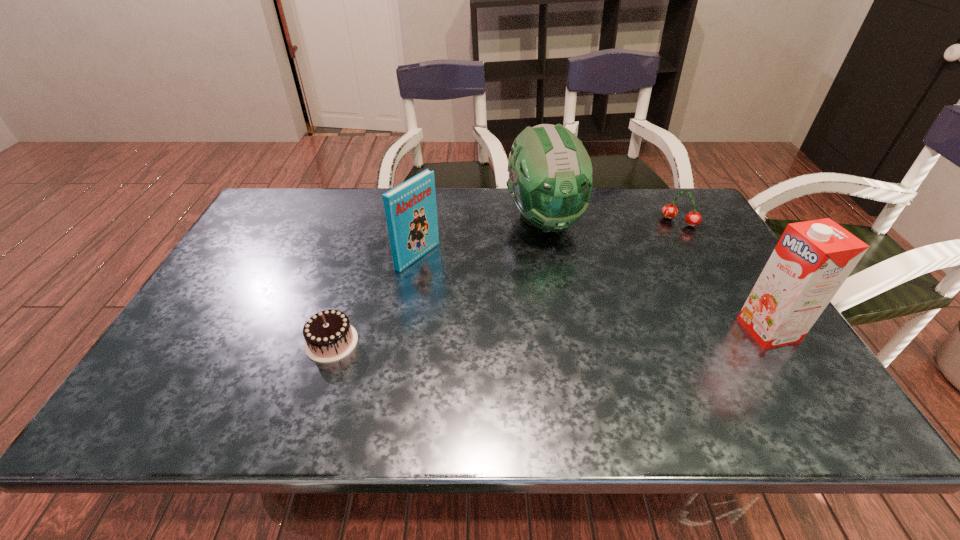
Where is `object present at the near edge`? Image resolution: width=960 pixels, height=540 pixels. object present at the near edge is located at coordinates (329, 337).

This screenshot has width=960, height=540. I want to click on carton that is at the right edge, so click(x=811, y=261).

The image size is (960, 540). I want to click on cherry that is at the right edge, so click(x=669, y=211).

This screenshot has width=960, height=540. I want to click on object situated at the far right corner, so 669,211.

In the image, there is a desktop. Identify the location of vacant area at the far edge. point(513,226).

The height and width of the screenshot is (540, 960). What are the coordinates of `vacant space at the left edge` in the screenshot? It's located at [x=251, y=298].

Where is `free space at the right edge`? This screenshot has width=960, height=540. free space at the right edge is located at coordinates (687, 233).

This screenshot has width=960, height=540. I want to click on vacant region at the far left corner of the desktop, so click(x=276, y=202).

Locate an element on the screen. blank space at the near left corner of the desktop is located at coordinates (166, 360).

In the image, there is a desktop. What are the coordinates of `vacant region at the far right corner` in the screenshot? It's located at (688, 202).